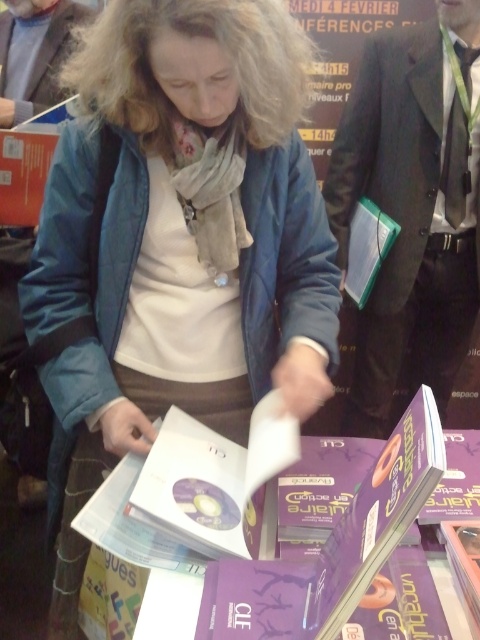
Looking at this image, which is more to the right, gray wool scarf at upper center or transparent plastic book at center?

transparent plastic book at center

Which is above, gray wool scarf at upper center or transparent plastic book at center?

gray wool scarf at upper center is above.

Measure the distance between gray wool scarf at upper center and camera.

gray wool scarf at upper center and camera are 6.18 feet apart.

Locate an element on the screen. This screenshot has width=480, height=640. gray wool scarf at upper center is located at coordinates (36, 52).

Which is above, matte blue jacket at center or gray wool scarf at upper center?

Positioned higher is gray wool scarf at upper center.

Which is below, matte blue jacket at center or gray wool scarf at upper center?

matte blue jacket at center is below.

Does point (215, 92) lie behind point (49, 76)?

No.

The image size is (480, 640). I want to click on matte blue jacket at center, so click(176, 243).

Who is shorter, matte blue jacket at center or transparent plastic book at center?

transparent plastic book at center is shorter.

Is point (80, 448) farther from camera compared to point (381, 232)?

No, it is not.

Who is more distant from viewer, (x=259, y=266) or (x=371, y=256)?

Point (x=371, y=256)

This screenshot has height=640, width=480. I want to click on matte blue jacket at center, so click(x=176, y=243).